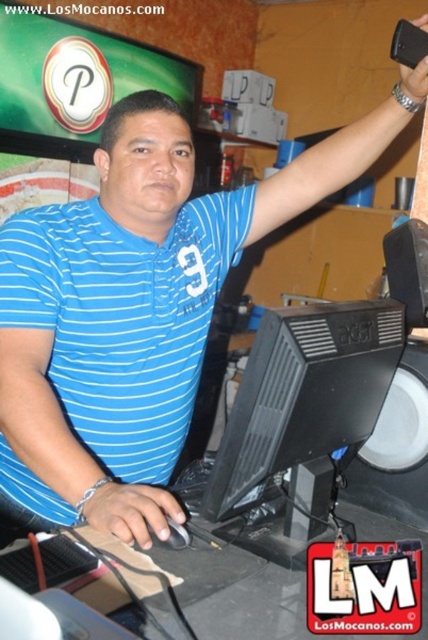
Is blue striped polo shirt at center further to camera compared to black plastic monitor at center?

Yes.

Which of these two, blue striped polo shirt at center or black plastic monitor at center, stands shorter?

black plastic monitor at center is shorter.

Locate an element on the screen. blue striped polo shirt at center is located at coordinates (122, 317).

Based on the photo, does black plastic monitor at center come in front of matte black phone at upper right?

Yes.

Measure the distance from black plastic monitor at center to matte black phone at upper right.

They are 74.44 centimeters apart.

You are a GUI agent. You are given a task and a screenshot of the screen. Output one action in this format:
    pyautogui.click(x=<x>, y=<y>)
    Task: Click on the black plastic monitor at center
    The width and height of the screenshot is (428, 640).
    Given the screenshot: What is the action you would take?
    pyautogui.click(x=303, y=396)

Can you confirm if blue striped polo shirt at center is smaller than matte black phone at upper right?

No.

Is point (214, 301) positioned before point (424, 67)?

No, it is not.

Find the location of `blue striped polo shirt at center`. blue striped polo shirt at center is located at coordinates (122, 317).